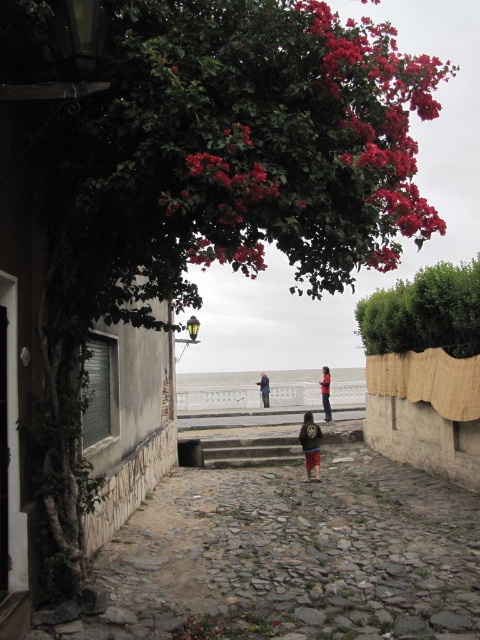
Who is positioned more to the left, green leafy bush at center or dark brown leather jacket at center?

dark brown leather jacket at center

The image size is (480, 640). Find the location of `green leafy bush at center`. green leafy bush at center is located at coordinates (424, 312).

Image resolution: width=480 pixels, height=640 pixels. In order to click on green leafy bush at center in this screenshot , I will do `click(424, 312)`.

Does green leafy bush at center appear under smooth concrete steps at center?

Incorrect, green leafy bush at center is not positioned below smooth concrete steps at center.

Who is more forward, (472, 301) or (229, 394)?

Point (472, 301) is in front.

Find the location of a particular element. green leafy bush at center is located at coordinates (424, 312).

Between smooth concrete steps at center and dark blue jacket at center, which one is positioned lower?

smooth concrete steps at center

Is smooth concrete steps at center wider than dark blue jacket at center?

Yes, smooth concrete steps at center is wider than dark blue jacket at center.

Is point (345, 378) positioned after point (264, 404)?

Yes.

You are a GUI agent. You are given a task and a screenshot of the screen. Output one action in this format:
    pyautogui.click(x=<x>, y=<y>)
    Task: Click on the smooth concrete steps at center
    This screenshot has height=640, width=480.
    Given the screenshot: What is the action you would take?
    pyautogui.click(x=216, y=392)